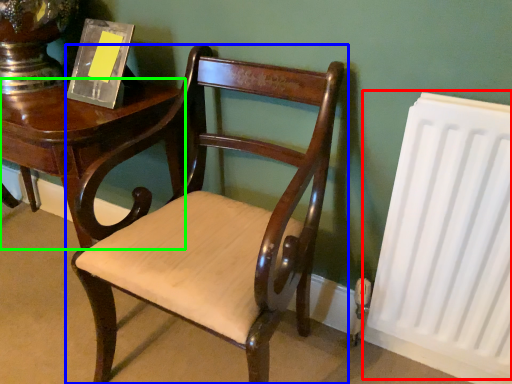
Question: Based on their relative distances, which object is nearer to radiator (highlighted by a red box)? Choose from chair (highlighted by a blue box) and table (highlighted by a green box).

Choices:
 (A) chair
 (B) table

Answer: (A)